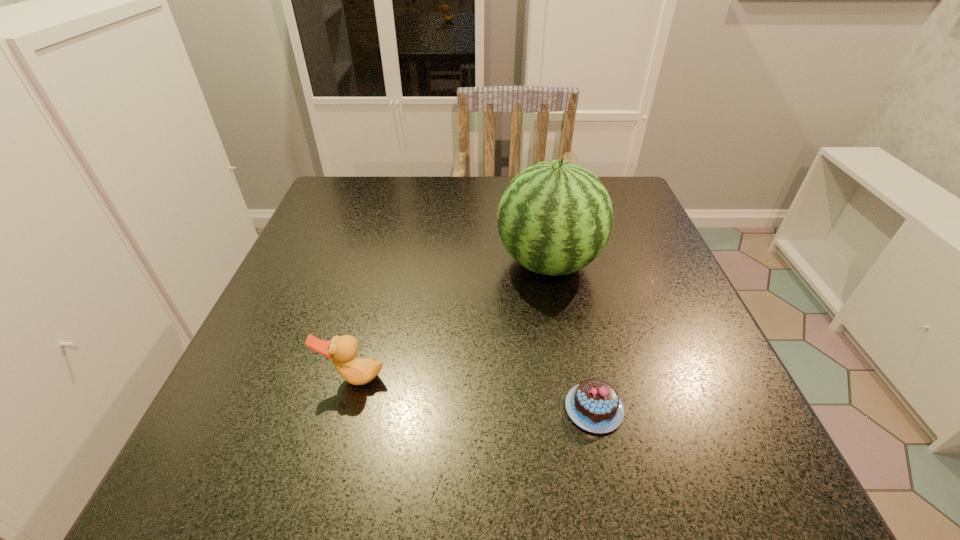
In the image, there is a desktop. What are the coordinates of `free region at the far edge` in the screenshot? It's located at (446, 200).

The image size is (960, 540). I want to click on vacant space at the left edge of the desktop, so click(234, 421).

Locate an element on the screen. The height and width of the screenshot is (540, 960). free point at the right edge is located at coordinates (607, 258).

The image size is (960, 540). In the image, there is a desktop. Find the location of `vacant space at the far left corner`. vacant space at the far left corner is located at coordinates (383, 178).

In the image, there is a desktop. Where is `vacant space at the far right corner`? This screenshot has width=960, height=540. vacant space at the far right corner is located at coordinates (619, 200).

Identify the location of vacant space at the near right corner of the desktop. The image size is (960, 540). (685, 467).

Find the location of `vacant point located between the shortest object and the tallest object`. vacant point located between the shortest object and the tallest object is located at coordinates (571, 336).

This screenshot has height=540, width=960. What are the coordinates of `vacant area that lies between the watermelon and the chocolate cake` in the screenshot? It's located at (571, 336).

Locate an element on the screen. This screenshot has height=540, width=960. vacant space that is in between the farthest object and the chocolate cake is located at coordinates (571, 336).

Identify the location of blank region between the duck and the chocolate cake. The width and height of the screenshot is (960, 540). (473, 393).